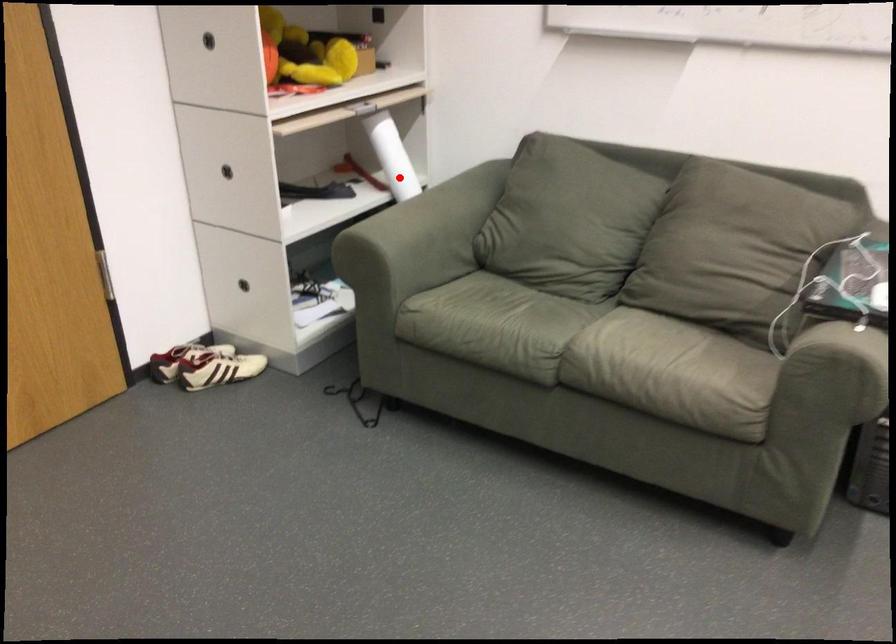
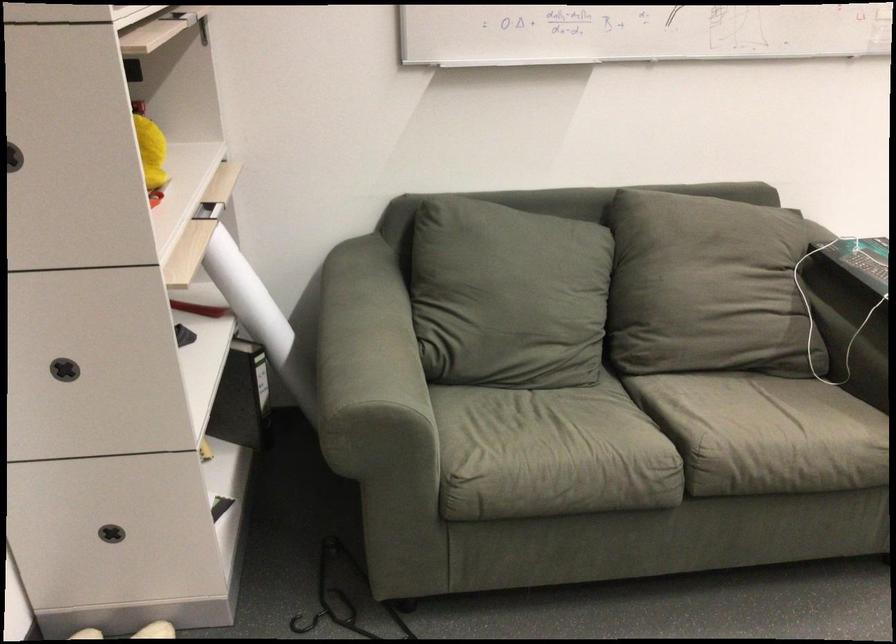
Where in the second image is the point corresponding to the highlighted location from the first image?

(247, 296)